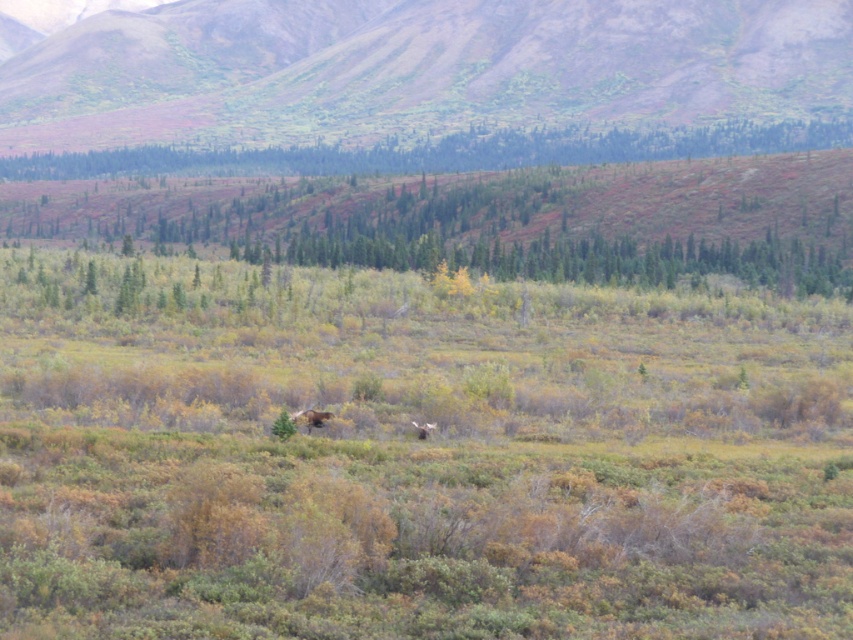
In the scene shown: You are standing at the origin point in the image. Where is the brown furry moose at center located in relation to you?

The brown furry moose at center is located at coordinates point (310,417) relative to your position at the origin.

You are standing at the bottom of the green grassy hillside at upper center. Looking up, you see the distant mountains in the background. Which direction should you walk to reach the mountains?

The green grassy hillside at upper center is located at point (x=418, y=68), so to reach the distant mountains in the background, you should walk towards the upper part of the image since the mountains are in the background and the hillside is at the upper center.